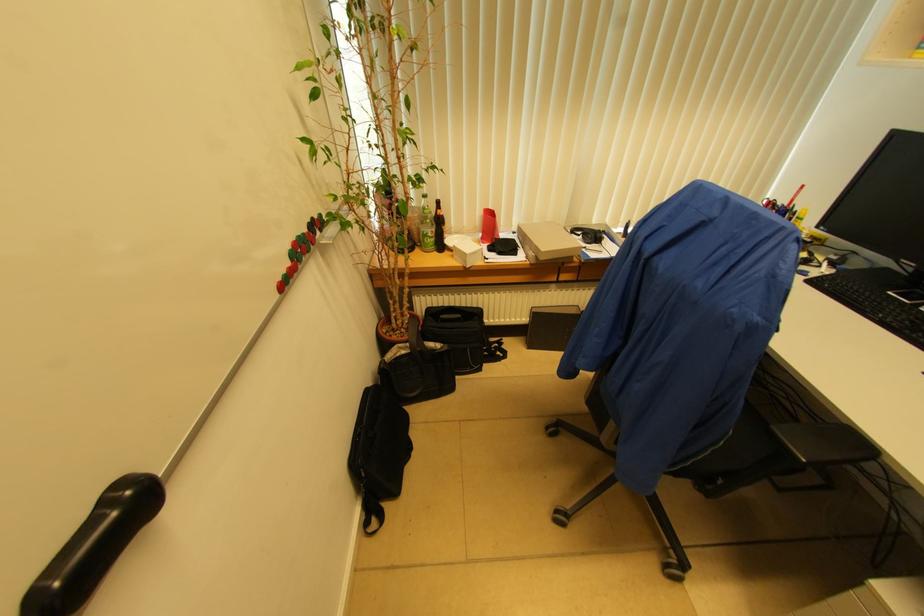
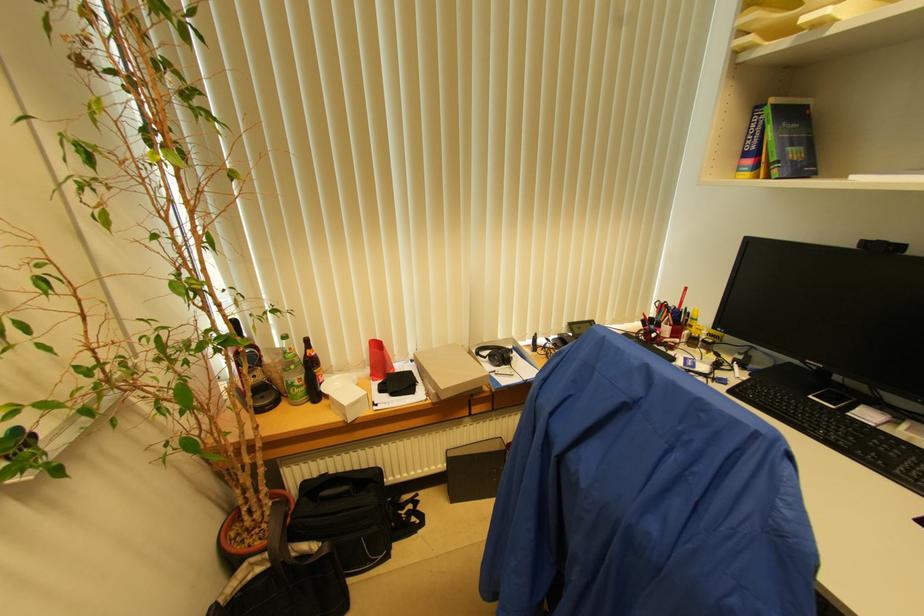
Locate, in the second image, the point that corresponds to pixel 599 237 in the first image.

(506, 358)